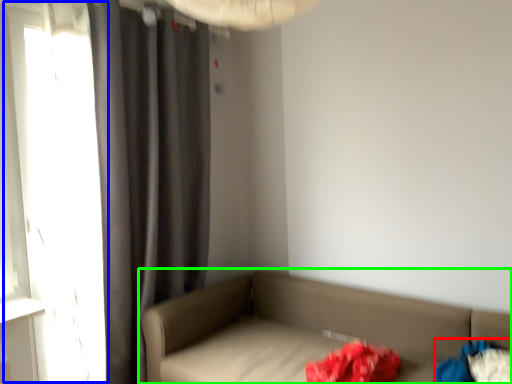
Question: Which object is the closest to the clothing (highlighted by a red box)? Choose among these: window (highlighted by a blue box) or studio couch (highlighted by a green box).

Choices:
 (A) window
 (B) studio couch

Answer: (B)